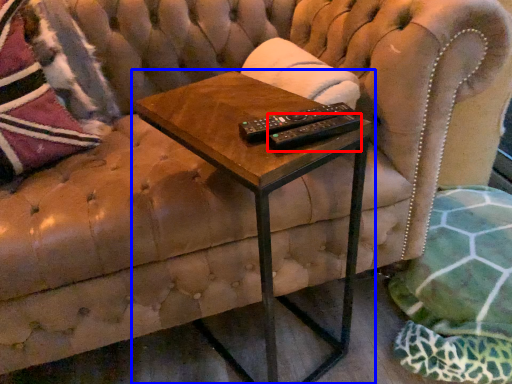
Question: Among these objects, which one is farthest to the camera, remote (highlighted by a red box) or table (highlighted by a blue box)?

Choices:
 (A) remote
 (B) table

Answer: (A)